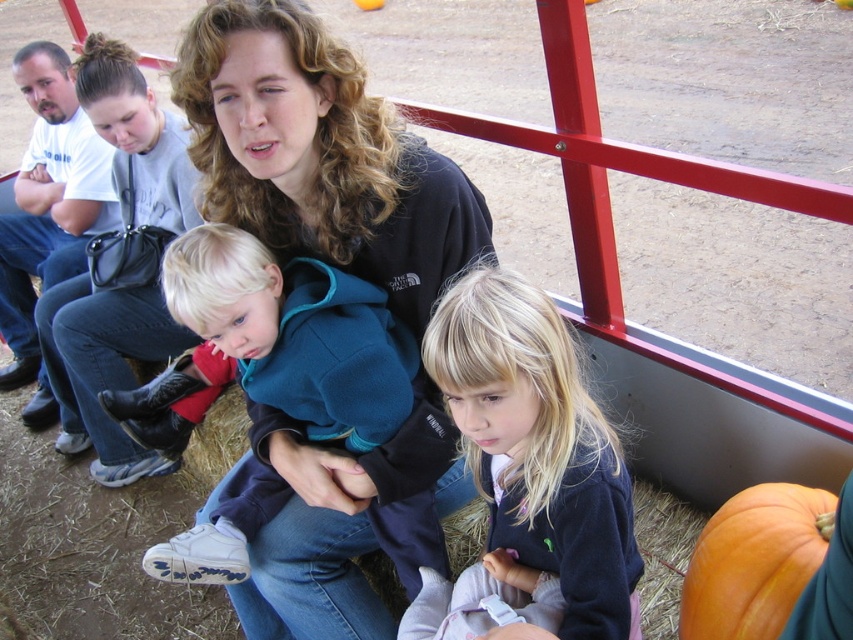
Question: Estimate the real-world distances between objects in this image. Which object is farther from the black fleece at center?

Choices:
 (A) orange matte pumpkin at lower right
 (B) black leather purse at upper left

Answer: (B)

Question: Is black fleece at center thinner than orange matte pumpkin at lower right?

Choices:
 (A) yes
 (B) no

Answer: (B)

Question: Can you confirm if red denim boot at left is positioned to the left of black leather purse at upper left?

Choices:
 (A) yes
 (B) no

Answer: (B)

Question: Considering the real-world distances, which object is farthest from the black fleece at center?

Choices:
 (A) red denim boot at left
 (B) orange matte pumpkin at lower right
 (C) black leather purse at upper left
 (D) blonde hair at center

Answer: (C)

Question: Is blonde hair at center positioned before red denim boot at left?

Choices:
 (A) yes
 (B) no

Answer: (A)

Question: Which point is closer to the camera taking this photo?

Choices:
 (A) (840, 612)
 (B) (494, 589)
 (C) (471, 236)

Answer: (A)